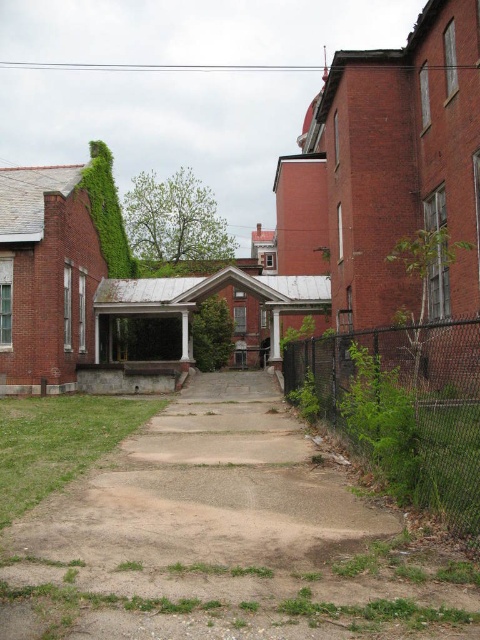
Who is more forward, (279, 582) or (194, 321)?

Point (279, 582) is in front.

Who is more distant from viewer, (184, 497) or (203, 369)?

Positioned behind is point (203, 369).

You are a GUI agent. You are given a task and a screenshot of the screen. Output one action in this format:
    pyautogui.click(x=<x>, y=<y>)
    Task: Click on the dirt/gravel path at center
    This screenshot has width=480, height=640.
    Given the screenshot: What is the action you would take?
    pyautogui.click(x=210, y=529)

The height and width of the screenshot is (640, 480). Identify the location of dirt/gravel path at center. (210, 529).

Does point (115, 189) lie in front of point (219, 355)?

Yes, it is.

Who is more distant from viewer, [111,193] or [211,360]?

Positioned behind is point [211,360].

Locate an element on the screen. green leafy ivy at upper left is located at coordinates (107, 211).

Measure the distance between green chain-link fence at lower right and camera.

green chain-link fence at lower right is 4.61 meters away from camera.

Does green chain-link fence at lower right have a lesser width compared to green matte ivy at center?

Indeed, green chain-link fence at lower right has a lesser width compared to green matte ivy at center.

Measure the distance between point [440,515] and camera.

5.28 meters

Find the location of `green chain-link fence at lower right`. green chain-link fence at lower right is located at coordinates (404, 406).